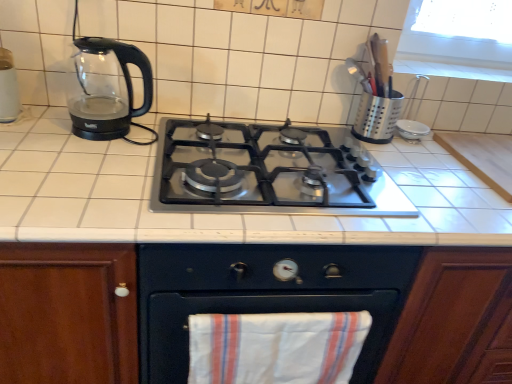
At what (x,y) coordinates should I click in order to perform the action: click on empty space that is ontop of white tile countertop at center (from a real-world perspective). Please return your answer as a coordinate pair (x, y). The width and height of the screenshot is (512, 384). Looking at the image, I should click on (260, 164).